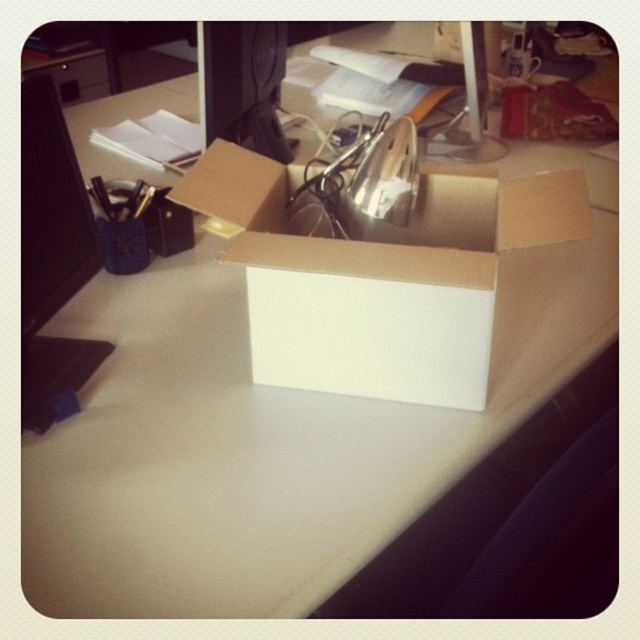
You are organizing your desk and need to know which monitor takes up more space. Which one is larger in size between the black glossy computer monitor at left and the matte black monitor at upper center?

The matte black monitor at upper center is larger in size than the black glossy computer monitor at left.

You are organizing your desk and need to move the brown cardboard box at center. To make space, you want to place it on top of the black glossy computer monitor at left. Is this possible based on their positions?

The brown cardboard box at center is located below the black glossy computer monitor at left, so it is already positioned under the monitor. Moving it on top would require the monitor to be lower or the box to be elevated, which isn answer the spatial arrangement described.

You are organizing the desk and need to place a new item between the brown cardboard box at center and the matte black monitor at upper center. Is there enough vertical space between them to fit an object that is 10 cm tall?

The brown cardboard box at center is below the matte black monitor at upper center. Since the vertical distance between them is not specified, we cannot determine if there is enough space to fit a 10 cm tall object.